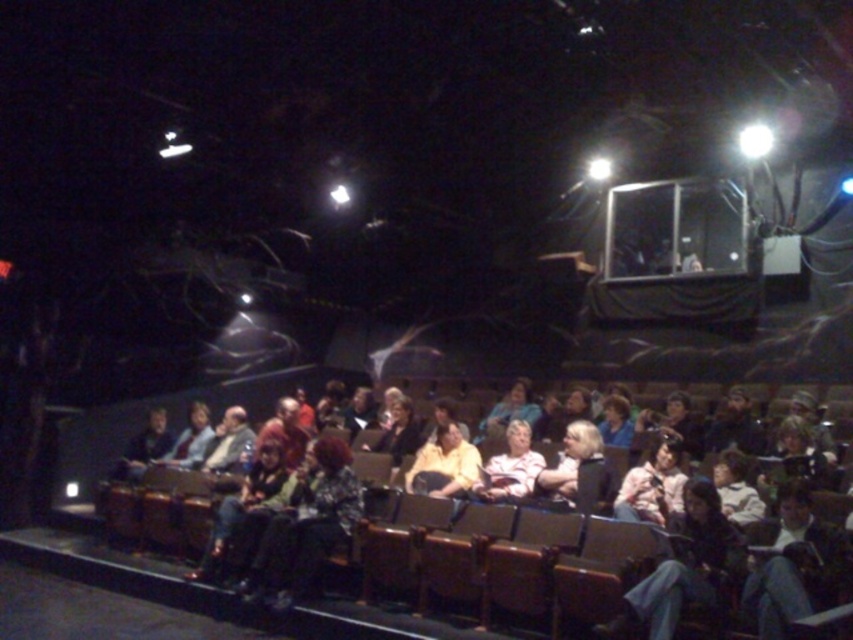
You are standing in the theater and want to reach the point at coordinates point (306, 563). If you walk straight ahead, will you reach it within 5 meters?

The distance between you and the point (306, 563) is 5.15 meters, so you will not reach it within 5 meters.

Consider the image. You are sitting in the theater and notice two people in front of you wearing a matte yellow shirt at center and a light blue fabric jacket at center. Which one is sitting to the right of the other?

The matte yellow shirt at center is positioned on the right side of the light blue fabric jacket at center.